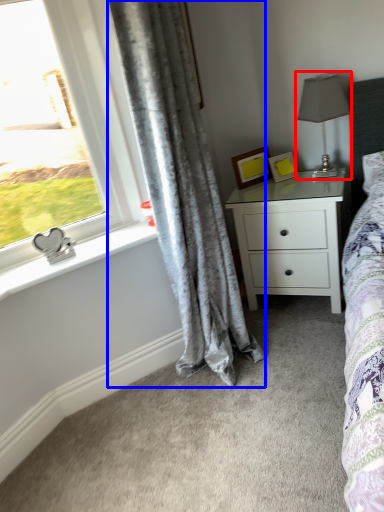
Question: Which of the following is the closest to the observer, table lamp (highlighted by a red box) or curtain (highlighted by a blue box)?

Choices:
 (A) table lamp
 (B) curtain

Answer: (B)